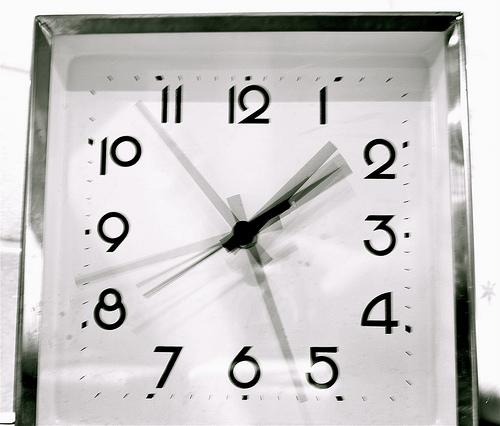
Identify the location of clock. (222, 160).